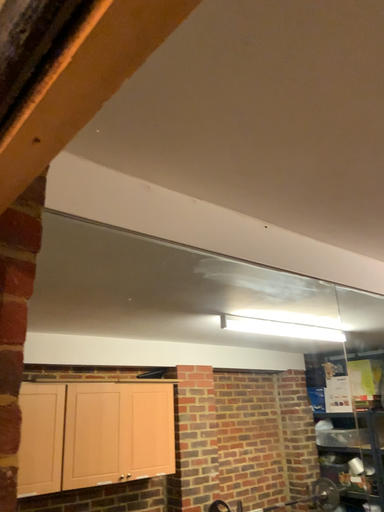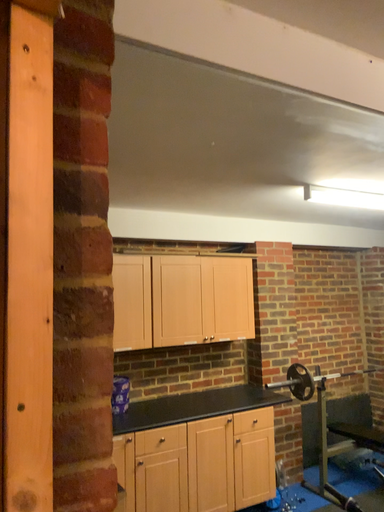
Question: Which way did the camera rotate in the video?

Choices:
 (A) rotated right
 (B) rotated left

Answer: (B)